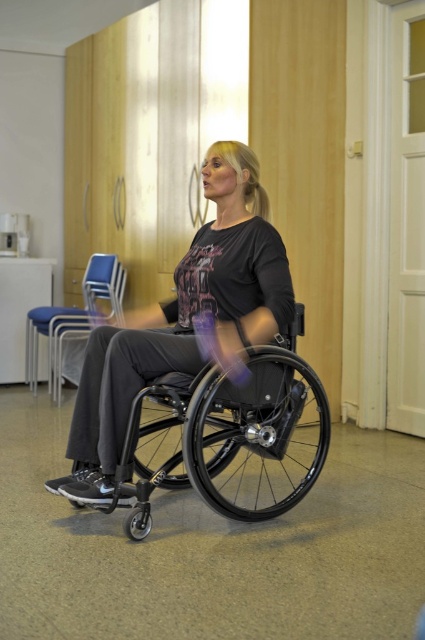
Is matte black wheelchair at center taller than blue fabric chair at center?

Indeed, matte black wheelchair at center has a greater height compared to blue fabric chair at center.

Is matte black wheelchair at center below blue fabric chair at center?

Actually, matte black wheelchair at center is above blue fabric chair at center.

Who is more distant from viewer, (79, 426) or (121, 296)?

Point (121, 296)

The image size is (425, 640). Find the location of `matte black wheelchair at center`. matte black wheelchair at center is located at coordinates (184, 317).

Who is taller, black plastic wheelchair at center or blue fabric chair at center?

blue fabric chair at center is taller.

Does black plastic wheelchair at center have a lesser height compared to blue fabric chair at center?

Correct, black plastic wheelchair at center is not as tall as blue fabric chair at center.

This screenshot has height=640, width=425. In order to click on black plastic wheelchair at center in this screenshot , I will do `click(231, 436)`.

Is matte black wheelchair at center closer to camera compared to black plastic wheelchair at center?

No.

Does matte black wheelchair at center have a greater height compared to black plastic wheelchair at center?

Yes, matte black wheelchair at center is taller than black plastic wheelchair at center.

What do you see at coordinates (184, 317) in the screenshot? Image resolution: width=425 pixels, height=640 pixels. I see `matte black wheelchair at center` at bounding box center [184, 317].

Where is `matte black wheelchair at center`? matte black wheelchair at center is located at coordinates (184, 317).